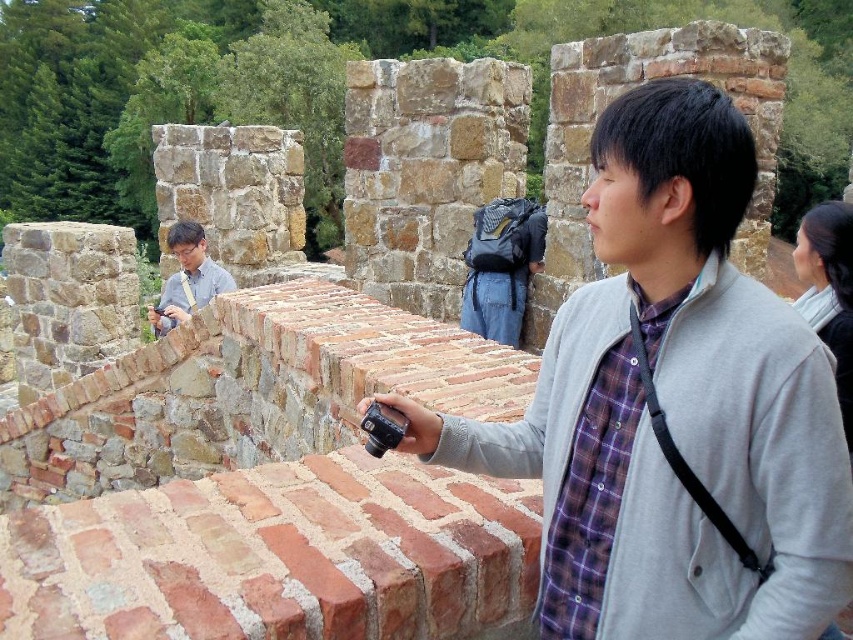
Question: Does gray matte jacket at center appear over matte gray shirt at center?

Choices:
 (A) no
 (B) yes

Answer: (A)

Question: Among these points, which one is nearest to the camera?

Choices:
 (A) (666, 604)
 (B) (213, 266)

Answer: (A)

Question: Which point is farther to the camera?

Choices:
 (A) (647, 301)
 (B) (228, 285)

Answer: (B)

Question: Can you confirm if gray matte jacket at center is bigger than matte gray shirt at center?

Choices:
 (A) no
 (B) yes

Answer: (B)

Question: Is gray matte jacket at center positioned in front of matte gray shirt at center?

Choices:
 (A) yes
 (B) no

Answer: (A)